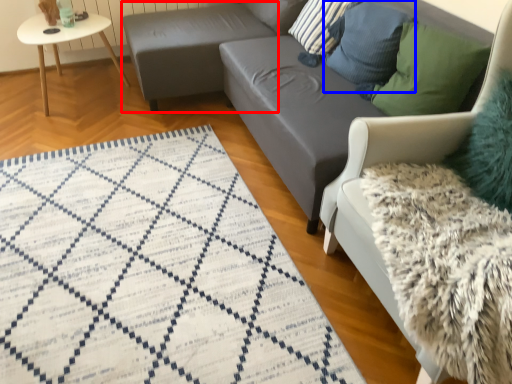
Question: Which object appears closest to the camera in this image, footrest (highlighted by a red box) or pillow (highlighted by a blue box)?

Choices:
 (A) footrest
 (B) pillow

Answer: (B)